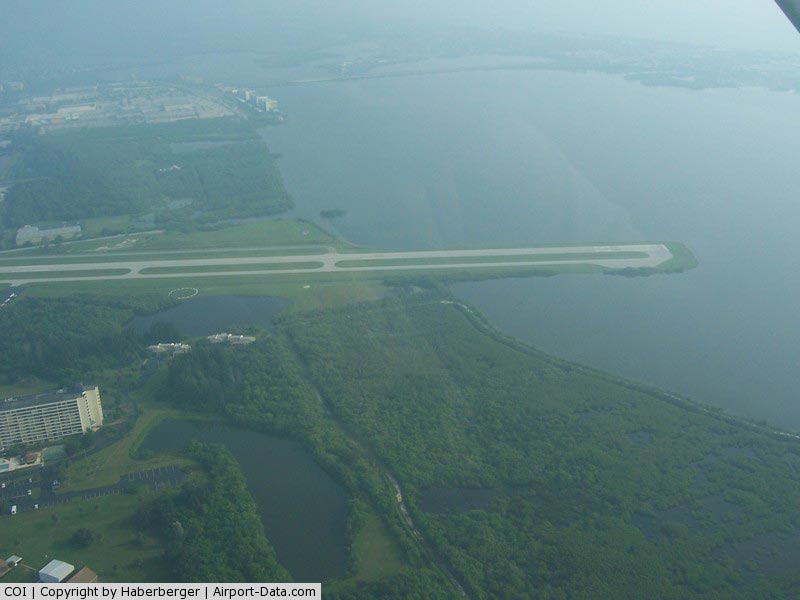
At what (x,y) coordinates should I click in order to perform the action: click on windows. Please return your answer as a coordinate pair (x, y). Image resolution: width=800 pixels, height=600 pixels. Looking at the image, I should click on (73, 400), (58, 403).